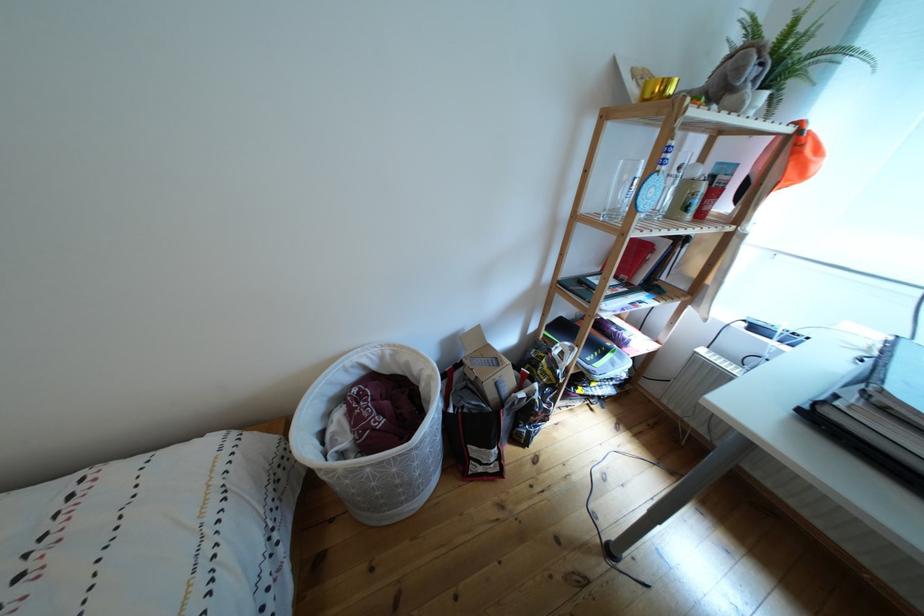
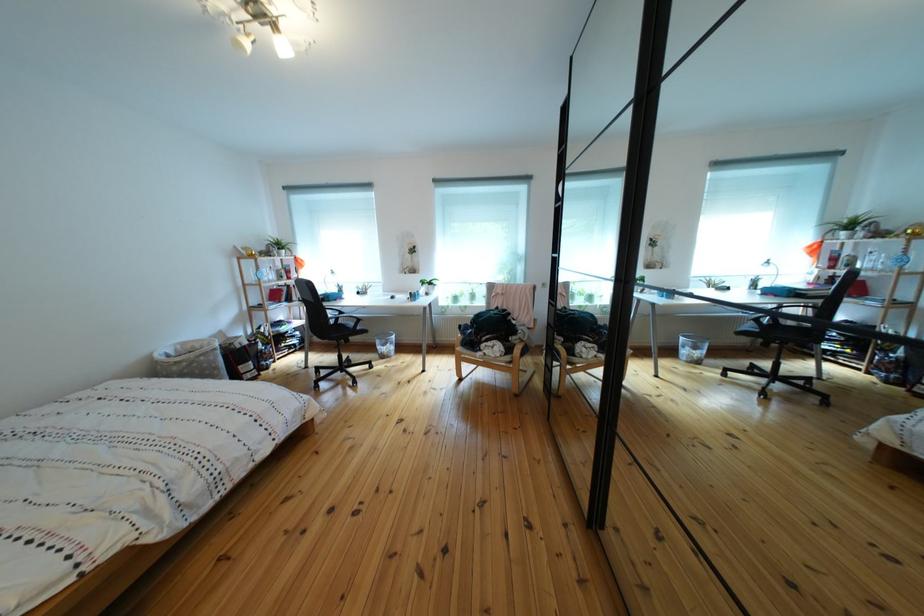
The point at (393,363) is marked in the first image. Where is the corresponding point in the second image?

(187, 355)